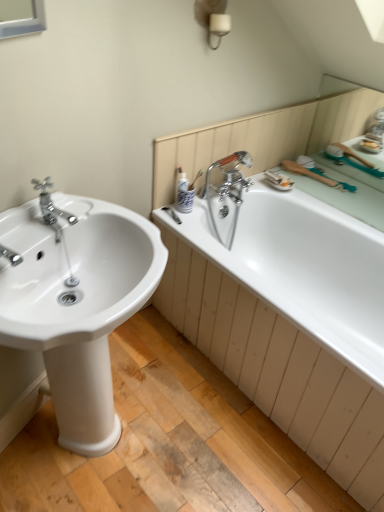
At what (x,y) coordinates should I click in order to perform the action: click on spots to the right of white glossy sink at left. Please return your answer as a coordinate pair (x, y). Looking at the image, I should click on (214, 441).